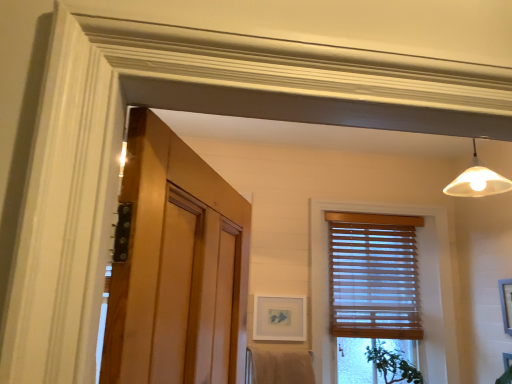
Question: Is beige cotton bath towel at lower center wider than green leafy plant at lower right?

Choices:
 (A) yes
 (B) no

Answer: (B)

Question: Does beige cotton bath towel at lower center have a greater height compared to green leafy plant at lower right?

Choices:
 (A) yes
 (B) no

Answer: (B)

Question: Does beige cotton bath towel at lower center come behind green leafy plant at lower right?

Choices:
 (A) yes
 (B) no

Answer: (B)

Question: From the image's perspective, is beige cotton bath towel at lower center above green leafy plant at lower right?

Choices:
 (A) no
 (B) yes

Answer: (B)

Question: Is beige cotton bath towel at lower center looking in the opposite direction of green leafy plant at lower right?

Choices:
 (A) no
 (B) yes

Answer: (A)

Question: From a real-world perspective, is wooden blinds at center above or below green leafy plant at lower right?

Choices:
 (A) below
 (B) above

Answer: (B)

Question: Which is correct: wooden blinds at center is inside green leafy plant at lower right, or outside of it?

Choices:
 (A) inside
 (B) outside

Answer: (B)

Question: Considering the positions of point (446, 367) and point (413, 379), is point (446, 367) closer or farther from the camera than point (413, 379)?

Choices:
 (A) farther
 (B) closer

Answer: (A)

Question: Is wooden blinds at center taller or shorter than green leafy plant at lower right?

Choices:
 (A) short
 (B) tall

Answer: (B)

Question: Considering the relative positions of green leafy plant at lower right and wooden blinds at right in the image provided, is green leafy plant at lower right to the left or to the right of wooden blinds at right?

Choices:
 (A) right
 (B) left

Answer: (A)

Question: From a real-world perspective, is green leafy plant at lower right above or below wooden blinds at right?

Choices:
 (A) below
 (B) above

Answer: (A)

Question: Considering the positions of green leafy plant at lower right and wooden blinds at right in the image, is green leafy plant at lower right taller or shorter than wooden blinds at right?

Choices:
 (A) tall
 (B) short

Answer: (B)

Question: Relative to wooden blinds at right, is green leafy plant at lower right in front or behind?

Choices:
 (A) behind
 (B) front

Answer: (B)

Question: Visually, is wooden blinds at center positioned to the left or to the right of matte white picture frame at center, acting as the second picture frame starting from the right?

Choices:
 (A) right
 (B) left

Answer: (A)

Question: Is wooden blinds at center taller or shorter than matte white picture frame at center, which is the 2th picture frame in front-to-back order?

Choices:
 (A) short
 (B) tall

Answer: (B)